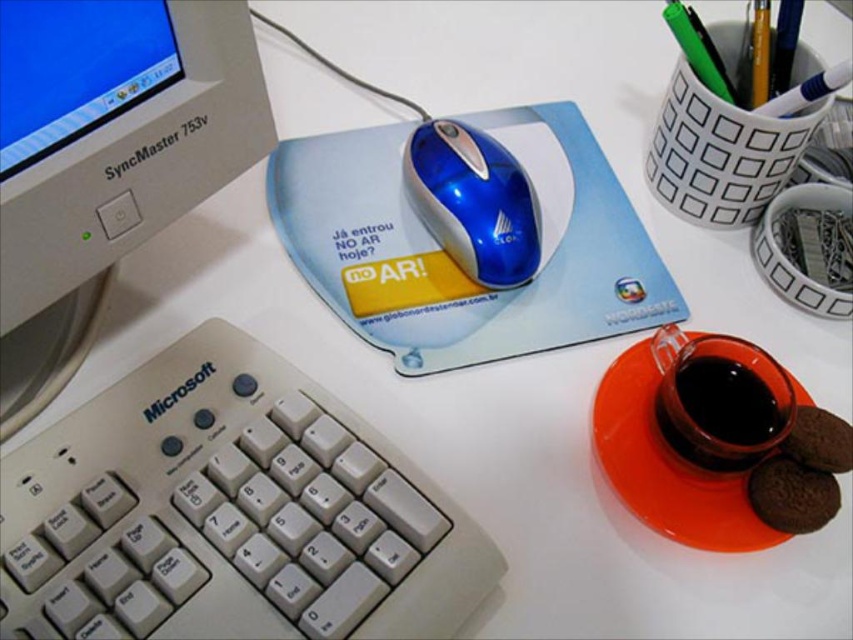
What is the 2D coordinate of the white plastic keyboard at lower left?

The white plastic keyboard at lower left is located at the 2D coordinate point of (x=229, y=513).

You are setting up your desk and need to place the white plastic keyboard at lower left and the white plastic monitor at upper left. Since you want to ensure that the monitor is taller than the keyboard, does the current setup meet your requirement?

Yes, the white plastic keyboard at lower left has a lesser height compared to the white plastic monitor at upper left, so the current setup meets your requirement that the monitor is taller than the keyboard.